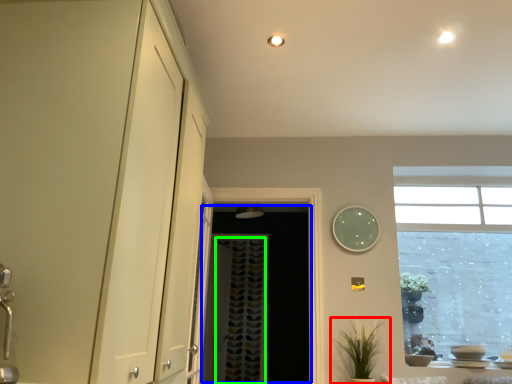
Question: Considering the real-world distances, which object is closest to houseplant (highlighted by a red box)? screen door (highlighted by a blue box) or curtain (highlighted by a green box).

Choices:
 (A) screen door
 (B) curtain

Answer: (A)